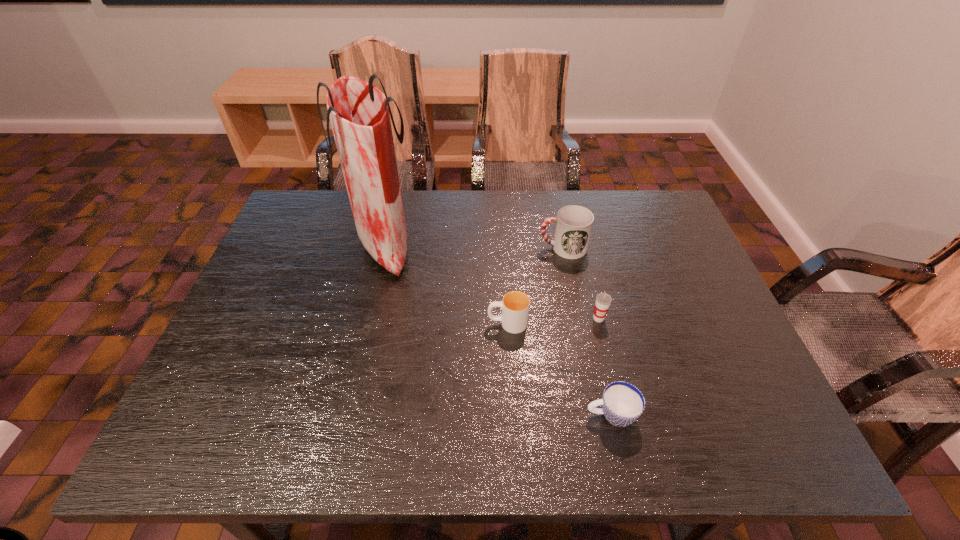
Locate an element on the screen. the tallest object is located at coordinates (359, 112).

Find the location of a particular element. The width and height of the screenshot is (960, 540). the leftmost object is located at coordinates click(x=359, y=112).

The image size is (960, 540). I want to click on the farthest cup, so click(x=574, y=223).

The height and width of the screenshot is (540, 960). What are the coordinates of `the third tallest cup` in the screenshot? It's located at (515, 306).

Where is `the second object from left to right`? The image size is (960, 540). the second object from left to right is located at coordinates (515, 306).

The width and height of the screenshot is (960, 540). I want to click on the shortest object, so click(622, 403).

I want to click on the nearest object, so click(x=622, y=403).

Locate an element on the screen. This screenshot has height=540, width=960. vacant space situated 0.190m on the front of the grocery bag is located at coordinates (364, 337).

What are the coordinates of `vacant region located 0.210m on the side of the farthest cup where the handle is located` in the screenshot? It's located at (466, 248).

Image resolution: width=960 pixels, height=540 pixels. I want to click on free location located on the side of the farthest cup where the handle is located, so [x=444, y=248].